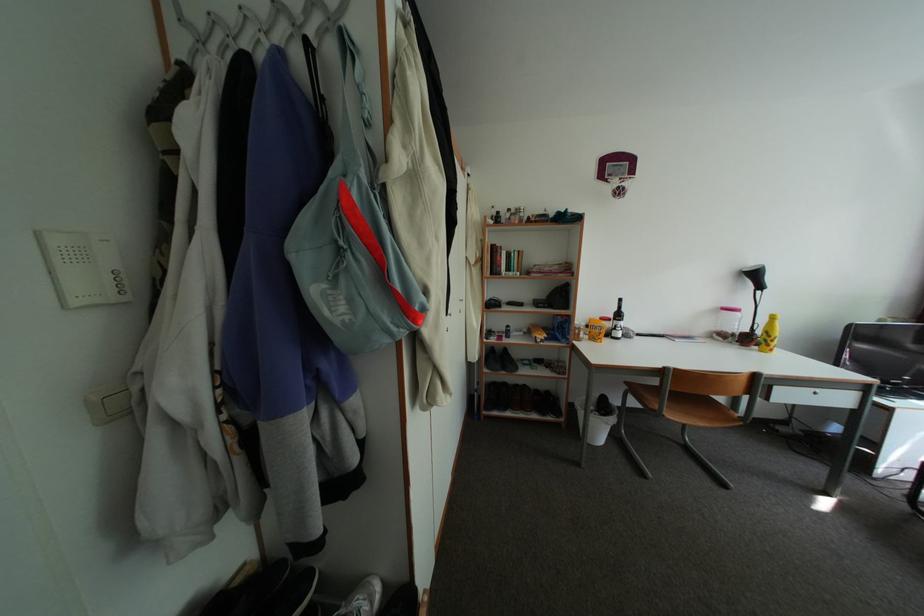
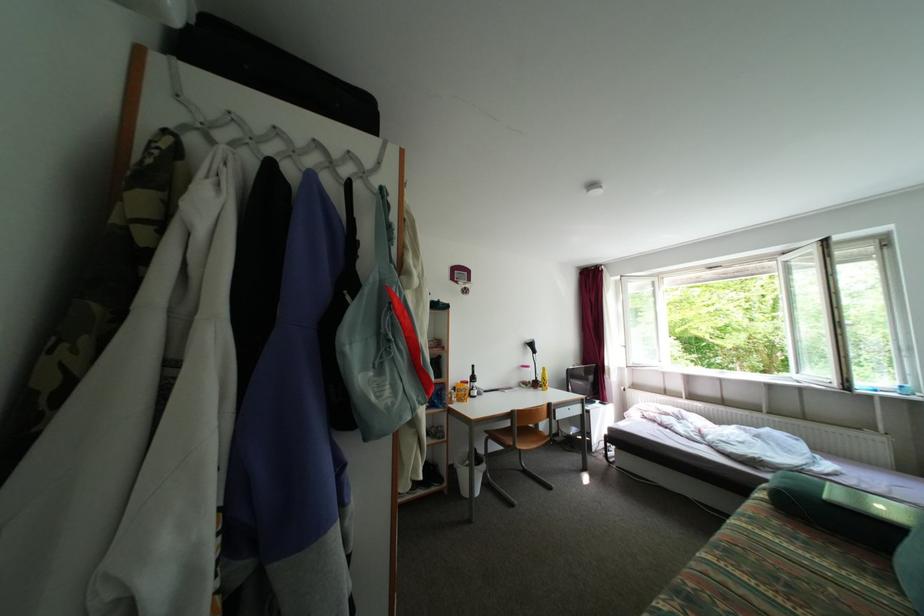
Question: The camera is either moving clockwise (left) or counter-clockwise (right) around the object. The first image is from the beginning of the video and the second image is from the end. Is the camera moving left or right when shooting the video?

Choices:
 (A) Left
 (B) Right

Answer: (A)